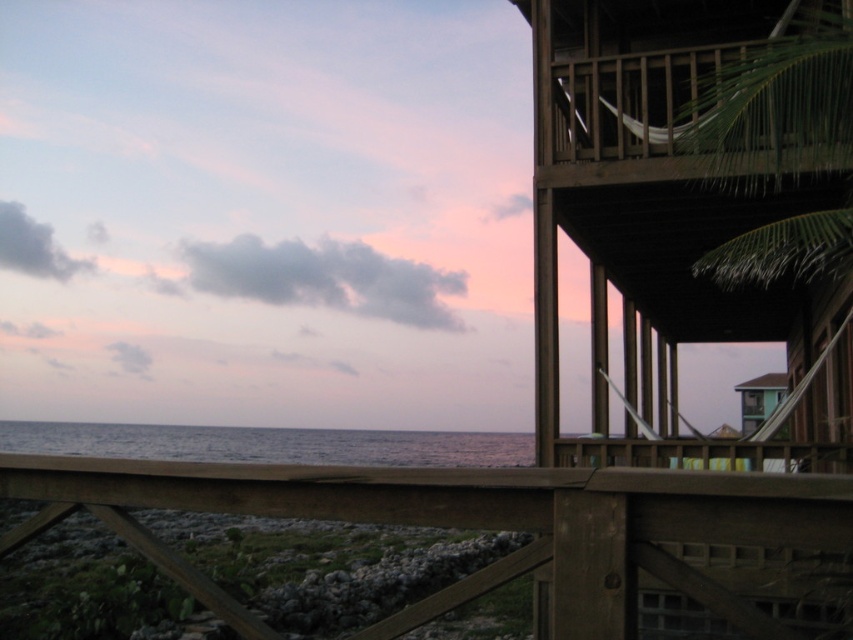
Which is more to the left, brown wooden deck at lower center or green leafy palm tree at upper right?

brown wooden deck at lower center

Who is more distant from viewer, (552, 488) or (804, 262)?

The point (804, 262) is more distant.

What are the coordinates of `brown wooden deck at lower center` in the screenshot? It's located at (471, 524).

Between brown wooden balcony at upper right and green leafy palm tree at upper right, which one is positioned lower?

brown wooden balcony at upper right is below.

Between brown wooden balcony at upper right and green leafy palm tree at upper right, which one appears on the left side from the viewer's perspective?

green leafy palm tree at upper right

Find the location of a particular element. brown wooden balcony at upper right is located at coordinates (650, 198).

Which is more to the left, brown wooden balcony at upper right or brown wooden deck at lower center?

brown wooden deck at lower center

Can you confirm if brown wooden balcony at upper right is wider than brown wooden deck at lower center?

Correct, the width of brown wooden balcony at upper right exceeds that of brown wooden deck at lower center.

Is point (613, 141) farther from viewer compared to point (474, 518)?

Yes, point (613, 141) is farther from viewer.

Where is `brown wooden balcony at upper right`? This screenshot has height=640, width=853. brown wooden balcony at upper right is located at coordinates (650, 198).